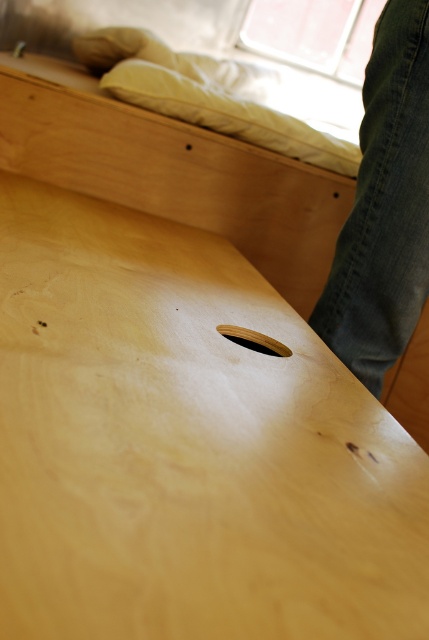
You are standing 5 feet away from the wooden surface shown in the image. There is a point at coordinates point (175, 227) on the surface. Can you reach that point without moving closer than your current position?

The distance of point (175, 227) from viewer is 4.74 feet, so yes, you can reach it from your current position since you are standing 5 feet away, which is farther than the point.

You are standing in the room and see the wooden surface with a circular hole near the center. There is a dark blue jeans at right located at point (x=384, y=205). Can you tell me the position of the dark blue jeans at right relative to the circular hole near the center?

The dark blue jeans at right is located at point (x=384, y=205), which is to the right of the circular hole near the center.

You are standing in a room with a bed and looking at the wooden surface. Where is the natural wood plywood at center located in terms of coordinates?

The natural wood plywood at center is located at coordinates point [186,445].